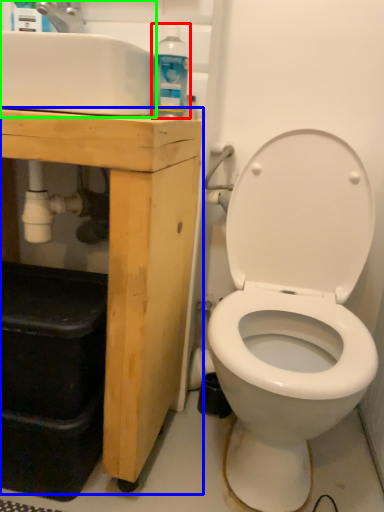
Question: Which is nearer to the cleaning product (highlighted by a red box)? porcelain (highlighted by a blue box) or sink (highlighted by a green box).

Choices:
 (A) porcelain
 (B) sink

Answer: (B)